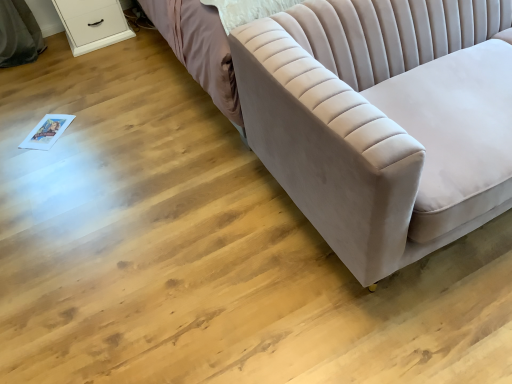
Question: Is white glossy dresser at upper left oriented away from velvet beige couch at right?

Choices:
 (A) no
 (B) yes

Answer: (A)

Question: Is white glossy dresser at upper left at the left side of velvet beige couch at right?

Choices:
 (A) yes
 (B) no

Answer: (A)

Question: Is white glossy dresser at upper left positioned far away from velvet beige couch at right?

Choices:
 (A) no
 (B) yes

Answer: (B)

Question: From the image's perspective, is white glossy dresser at upper left on velvet beige couch at right?

Choices:
 (A) yes
 (B) no

Answer: (A)

Question: Is white glossy dresser at upper left directly adjacent to velvet beige couch at right?

Choices:
 (A) yes
 (B) no

Answer: (B)

Question: From a real-world perspective, does white glossy dresser at upper left sit lower than velvet beige couch at right?

Choices:
 (A) no
 (B) yes

Answer: (B)

Question: Is velvet beige couch at right not near white glossy dresser at upper left?

Choices:
 (A) yes
 (B) no

Answer: (A)

Question: Would you say velvet beige couch at right contains white glossy dresser at upper left?

Choices:
 (A) yes
 (B) no

Answer: (B)

Question: From the image's perspective, is velvet beige couch at right below white glossy dresser at upper left?

Choices:
 (A) no
 (B) yes

Answer: (B)

Question: Is the depth of velvet beige couch at right greater than that of white glossy dresser at upper left?

Choices:
 (A) yes
 (B) no

Answer: (B)

Question: Is velvet beige couch at right positioned in front of white glossy dresser at upper left?

Choices:
 (A) yes
 (B) no

Answer: (A)

Question: Is velvet beige couch at right shorter than white glossy dresser at upper left?

Choices:
 (A) yes
 (B) no

Answer: (B)

Question: Would you say velvet beige couch at right is to the left or to the right of white glossy dresser at upper left in the picture?

Choices:
 (A) left
 (B) right

Answer: (B)